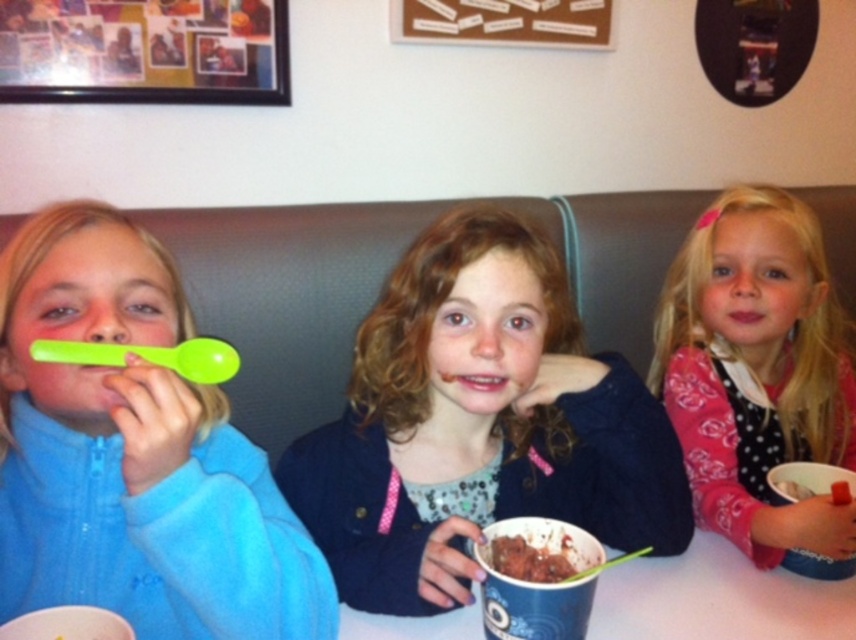
Based on the scene description and the coordinates provided, which object is located at point (479,424)?

The point (479,424) corresponds to the matte blue sweater at center.

You are a parent at the restaurant looking at the three children. You need to choose the larger of the two items between the matte green spoon at left and the chocolate ice cream at lower center. Which one is bigger?

The matte green spoon at left is larger than the chocolate ice cream at lower center according to the description.